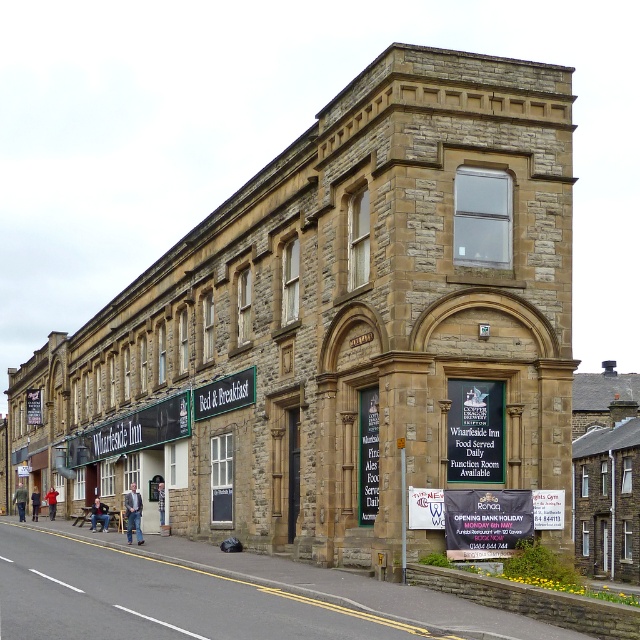
Who is lower down, white plastic banner at lower center or greensignboard at center?

white plastic banner at lower center is lower down.

Is white plastic banner at lower center positioned before greensignboard at center?

Yes, white plastic banner at lower center is in front of greensignboard at center.

The width and height of the screenshot is (640, 640). What do you see at coordinates (484, 522) in the screenshot? I see `white plastic banner at lower center` at bounding box center [484, 522].

This screenshot has height=640, width=640. In order to click on white plastic banner at lower center in this screenshot , I will do `click(484, 522)`.